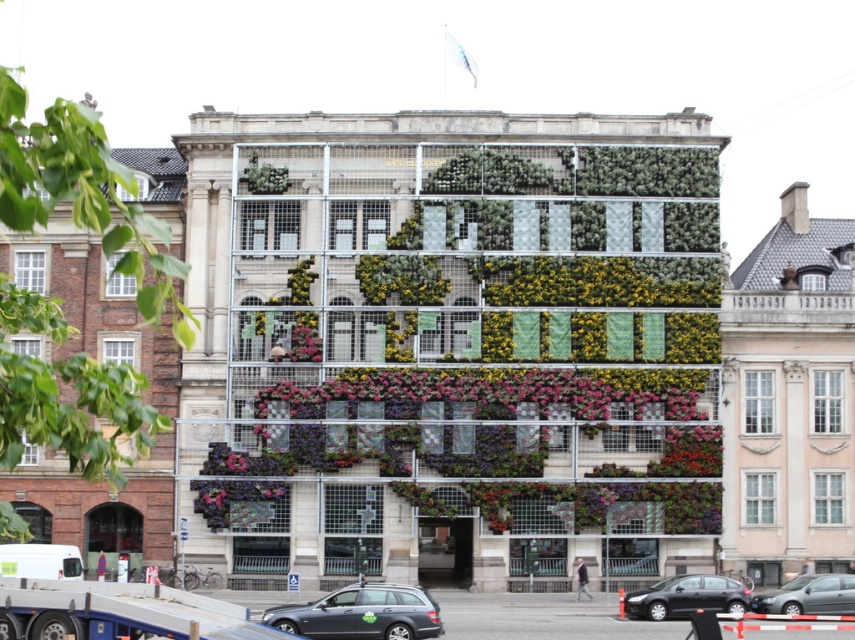
Question: Is the position of matte gray station wagon at lower center more distant than that of metallic silver sedan at center?

Choices:
 (A) yes
 (B) no

Answer: (B)

Question: Which point is farther to the camera?

Choices:
 (A) black glossy car at lower right
 (B) metallic silver sedan at center
 (C) matte gray station wagon at lower center

Answer: (B)

Question: Which of the following is the farthest from the observer?

Choices:
 (A) (809, 589)
 (B) (658, 595)

Answer: (A)

Question: From the image, what is the correct spatial relationship of matte gray station wagon at lower center in relation to black glossy car at lower right?

Choices:
 (A) above
 (B) below

Answer: (A)

Question: Is matte gray station wagon at lower center bigger than black glossy car at lower right?

Choices:
 (A) no
 (B) yes

Answer: (A)

Question: Which object is positioned closest to the matte gray station wagon at lower center?

Choices:
 (A) metallic silver sedan at center
 (B) black glossy car at lower right

Answer: (B)